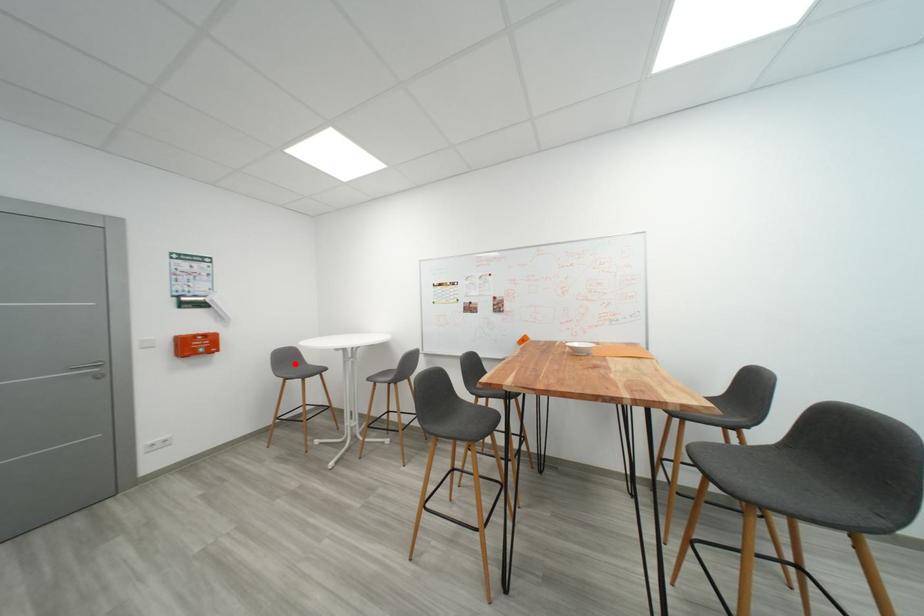
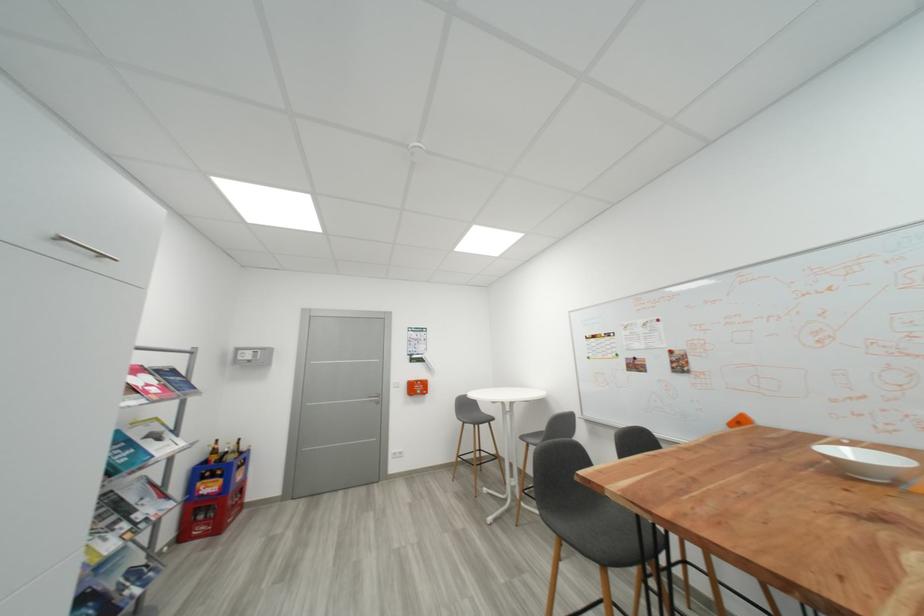
Question: I am providing you with two images of the same scene from different viewpoints. In image1, a red point is highlighted. Considering the same 3D point in image2, which of the following is correct?

Choices:
 (A) It is closer
 (B) It is farther

Answer: (B)